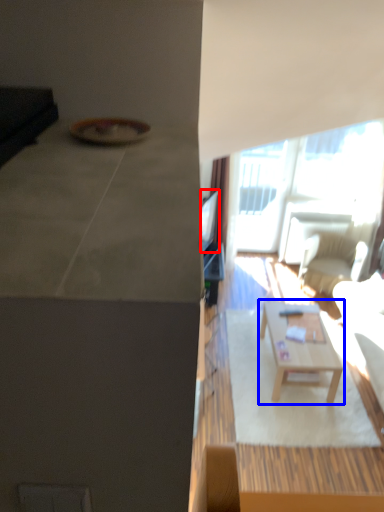
Question: Among these objects, which one is farthest to the camera, television (highlighted by a red box) or coffee table (highlighted by a blue box)?

Choices:
 (A) television
 (B) coffee table

Answer: (A)